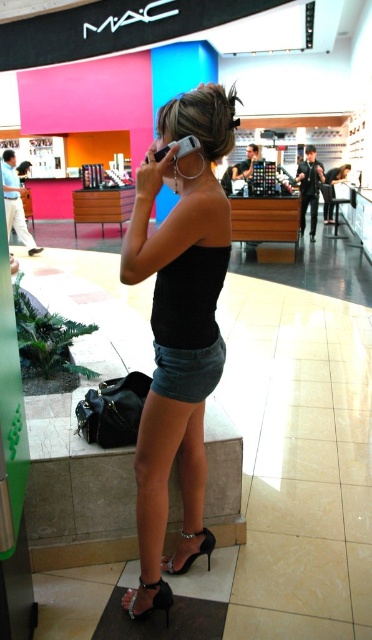
Which of these two, black leather jacket at center or black leather sandal at lower center, stands shorter?

black leather sandal at lower center is shorter.

Who is positioned more to the right, black leather jacket at center or black leather sandal at lower center?

From the viewer's perspective, black leather jacket at center appears more on the right side.

Identify the location of black leather jacket at center. This screenshot has width=372, height=640. [309, 188].

The width and height of the screenshot is (372, 640). Find the location of `black matte tank top at center`. black matte tank top at center is located at coordinates (180, 307).

Between point (191, 515) and point (143, 612), which one is positioned in front?

Point (143, 612) is more forward.

Who is more forward, (x=168, y=465) or (x=136, y=612)?

Point (x=168, y=465) is in front.

Locate an element on the screen. Image resolution: width=372 pixels, height=640 pixels. black matte tank top at center is located at coordinates (180, 307).

Between black leather sandal at lower center and matte black tank top at center, which one is positioned higher?

matte black tank top at center is higher up.

Is point (161, 598) less distant than point (335, 173)?

That is True.

This screenshot has height=640, width=372. Find the location of `black leather sandal at lower center`. black leather sandal at lower center is located at coordinates (154, 600).